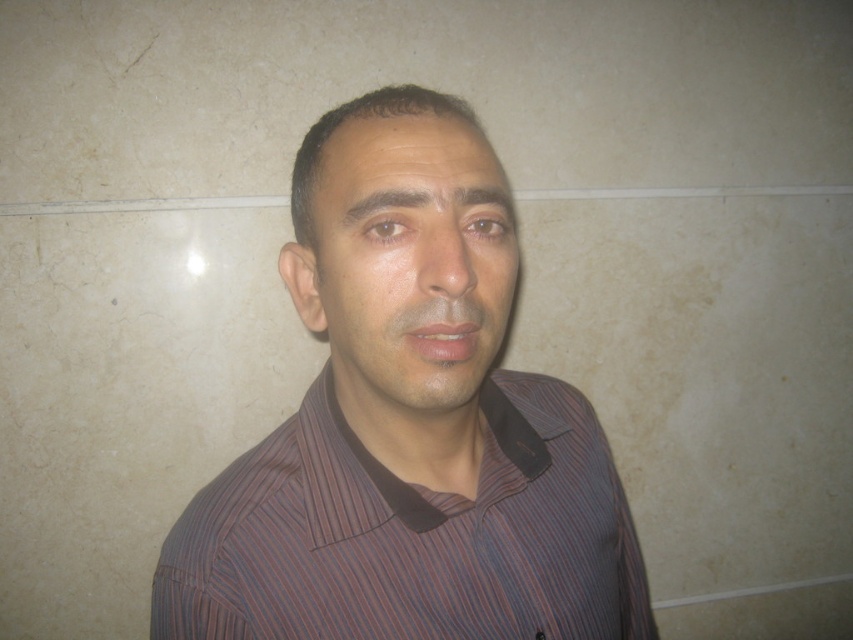
Question: Which point is closer to the camera?

Choices:
 (A) (511, 262)
 (B) (497, 339)
 (C) (395, 536)

Answer: (A)

Question: Which point appears closest to the camera in this image?

Choices:
 (A) (419, 502)
 (B) (489, 225)
 (C) (456, 333)

Answer: (C)

Question: Is striped shirt at center closer to camera compared to smooth skin face at center?

Choices:
 (A) no
 (B) yes

Answer: (B)

Question: Does striped cotton shirt at center lie behind smooth skin face at center?

Choices:
 (A) no
 (B) yes

Answer: (B)

Question: Where is striped shirt at center located in relation to smooth skin face at center in the image?

Choices:
 (A) right
 (B) left

Answer: (A)

Question: Which point appears closest to the camera in this image?

Choices:
 (A) click(x=508, y=582)
 (B) click(x=351, y=216)

Answer: (B)